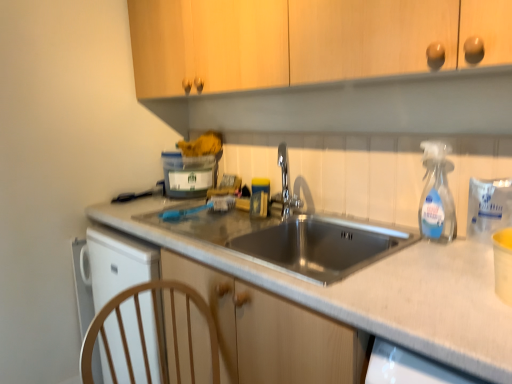
Find the location of a particular element. This screenshot has width=512, height=384. metallic gray sink at center is located at coordinates click(377, 292).

Measure the distance between clear plastic spray bottle at right and camera.

clear plastic spray bottle at right is 4.05 feet from camera.

Measure the distance between point (176, 194) and camera.

A distance of 2.00 meters exists between point (176, 194) and camera.

The image size is (512, 384). I want to click on chrome metallic faucet at center, so click(284, 189).

Where is `metallic gray sink at center`? The width and height of the screenshot is (512, 384). metallic gray sink at center is located at coordinates click(377, 292).

Is metallic gray sink at center positioned far away from chrome metallic faucet at center?

No.

Considering the sizes of metallic gray sink at center and chrome metallic faucet at center in the image, is metallic gray sink at center taller or shorter than chrome metallic faucet at center?

In the image, metallic gray sink at center appears to be taller than chrome metallic faucet at center.

Measure the distance between metallic gray sink at center and chrome metallic faucet at center.

metallic gray sink at center and chrome metallic faucet at center are 26.41 inches apart.

Is chrome metallic faucet at center far from translucent plastic container at upper center?

Actually, chrome metallic faucet at center and translucent plastic container at upper center are a little close together.

Is chrome metallic faucet at center wider than translucent plastic container at upper center?

No, chrome metallic faucet at center is not wider than translucent plastic container at upper center.

Is chrome metallic faucet at center oriented away from translucent plastic container at upper center?

chrome metallic faucet at center is not turned away from translucent plastic container at upper center.

Which of these two, chrome metallic faucet at center or translucent plastic container at upper center, stands shorter?

translucent plastic container at upper center.

From a real-world perspective, is translucent plastic container at upper center on top of metallic gray sink at center?

Correct, in the physical world, translucent plastic container at upper center is higher than metallic gray sink at center.

Is translucent plastic container at upper center inside or outside of metallic gray sink at center?

translucent plastic container at upper center lies outside metallic gray sink at center.

Is translucent plastic container at upper center at the right side of metallic gray sink at center?

No.

From the picture: Is translucent plastic container at upper center behind metallic gray sink at center?

Yes, translucent plastic container at upper center is further from the viewer.

Find the location of a particular element. This screenshot has width=512, height=384. tap behind the clear plastic spray bottle at right is located at coordinates (284, 189).

Is chrome metallic faucet at center bigger than clear plastic spray bottle at right?

Correct, chrome metallic faucet at center is larger in size than clear plastic spray bottle at right.

From a real-world perspective, is chrome metallic faucet at center physically below clear plastic spray bottle at right?

Yes, from a real-world perspective, chrome metallic faucet at center is beneath clear plastic spray bottle at right.

Is chrome metallic faucet at center to the left of clear plastic spray bottle at right from the viewer's perspective?

Yes, chrome metallic faucet at center is to the left of clear plastic spray bottle at right.

Is clear plastic spray bottle at right to the left or to the right of metallic gray sink at center in the image?

In the image, clear plastic spray bottle at right appears on the right side of metallic gray sink at center.

From a real-world perspective, does clear plastic spray bottle at right stand above metallic gray sink at center?

Correct, in the physical world, clear plastic spray bottle at right is higher than metallic gray sink at center.

Is there a large distance between clear plastic spray bottle at right and metallic gray sink at center?

clear plastic spray bottle at right is near metallic gray sink at center, not far away.

Which object is closer to the camera taking this photo, metallic gray sink at center or clear plastic spray bottle at right?

metallic gray sink at center is more forward.

From a real-world perspective, who is located higher, metallic gray sink at center or clear plastic spray bottle at right?

clear plastic spray bottle at right, from a real-world perspective.

Can you confirm if metallic gray sink at center is taller than clear plastic spray bottle at right?

Yes, metallic gray sink at center is taller than clear plastic spray bottle at right.

From the image's perspective, which is above, metallic gray sink at center or clear plastic spray bottle at right?

clear plastic spray bottle at right.

Is translucent plastic container at upper center not within chrome metallic faucet at center?

Yes.

Is translucent plastic container at upper center bigger or smaller than chrome metallic faucet at center?

translucent plastic container at upper center is bigger than chrome metallic faucet at center.

From the image's perspective, would you say translucent plastic container at upper center is shown under chrome metallic faucet at center?

No, from the image's perspective, translucent plastic container at upper center is not below chrome metallic faucet at center.

Can you confirm if translucent plastic container at upper center is taller than chrome metallic faucet at center?

No, translucent plastic container at upper center is not taller than chrome metallic faucet at center.

The width and height of the screenshot is (512, 384). I want to click on tap above the metallic gray sink at center (from the image's perspective), so click(284, 189).

What are the coordinates of `tap below the translucent plastic container at upper center (from the image's perspective)` in the screenshot? It's located at (284, 189).

Looking at the image, which one is located closer to translucent plastic container at upper center, clear plastic spray bottle at right or chrome metallic faucet at center?

The object closer to translucent plastic container at upper center is chrome metallic faucet at center.

Looking at the image, which one is located further to clear plastic spray bottle at right, translucent plastic container at upper center or chrome metallic faucet at center?

translucent plastic container at upper center lies further to clear plastic spray bottle at right than the other object.

Based on the photo, estimate the real-world distances between objects in this image. Which object is further from chrome metallic faucet at center, clear plastic spray bottle at right or metallic gray sink at center?

The object further to chrome metallic faucet at center is metallic gray sink at center.

Based on their spatial positions, is chrome metallic faucet at center or metallic gray sink at center further from translucent plastic container at upper center?

The object further to translucent plastic container at upper center is metallic gray sink at center.

When comparing their distances from chrome metallic faucet at center, does translucent plastic container at upper center or metallic gray sink at center seem further?

metallic gray sink at center is positioned further to the anchor chrome metallic faucet at center.

Looking at this image, based on their spatial positions, is chrome metallic faucet at center or translucent plastic container at upper center further from clear plastic spray bottle at right?

translucent plastic container at upper center is positioned further to the anchor clear plastic spray bottle at right.

Estimate the real-world distances between objects in this image. Which object is further from translucent plastic container at upper center, metallic gray sink at center or chrome metallic faucet at center?

The object further to translucent plastic container at upper center is metallic gray sink at center.

Looking at the image, which one is located further to clear plastic spray bottle at right, translucent plastic container at upper center or metallic gray sink at center?

translucent plastic container at upper center.

At what (x,y) coordinates should I click in order to perform the action: click on soap dispenser between metallic gray sink at center and translucent plastic container at upper center in the front-back direction. Please return your answer as a coordinate pair (x, y). Looking at the image, I should click on (437, 194).

Find the location of a particular element. This screenshot has width=512, height=384. tap between translucent plastic container at upper center and clear plastic spray bottle at right from left to right is located at coordinates (284, 189).

Image resolution: width=512 pixels, height=384 pixels. In order to click on soap dispenser between chrome metallic faucet at center and metallic gray sink at center in the vertical direction in this screenshot , I will do `click(437, 194)`.

The height and width of the screenshot is (384, 512). I want to click on tap between metallic gray sink at center and translucent plastic container at upper center from front to back, so click(284, 189).